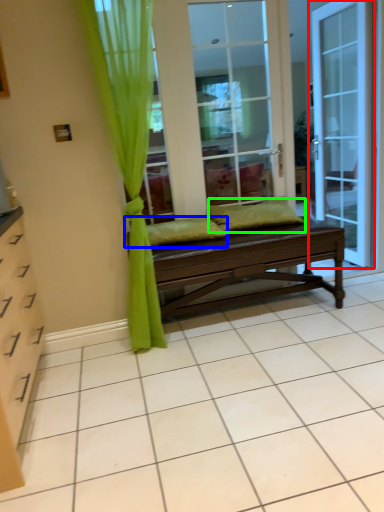
Question: Which is farther away from door (highlighted by a red box)? pillow (highlighted by a blue box) or pillow (highlighted by a green box)?

Choices:
 (A) pillow
 (B) pillow

Answer: (A)